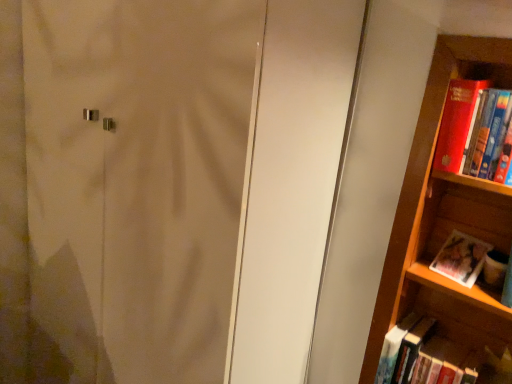
Question: Is matte white screen door at center looking in the opposite direction of hardcover book at lower right, positioned as the third book in top-to-bottom order?

Choices:
 (A) no
 (B) yes

Answer: (A)

Question: Is matte white screen door at center thinner than hardcover book at lower right, positioned as the first book in bottom-to-top order?

Choices:
 (A) yes
 (B) no

Answer: (B)

Question: Does matte white screen door at center turn towards hardcover book at lower right, positioned as the third book in top-to-bottom order?

Choices:
 (A) yes
 (B) no

Answer: (B)

Question: From the image's perspective, is matte white screen door at center below hardcover book at lower right, positioned as the third book in top-to-bottom order?

Choices:
 (A) no
 (B) yes

Answer: (A)

Question: Does matte white screen door at center lie in front of hardcover book at lower right, positioned as the third book in top-to-bottom order?

Choices:
 (A) yes
 (B) no

Answer: (A)

Question: Is matte paper photo album at right, which ranks as the 2th book in bottom-to-top order, in front of or behind hardcover book at lower right, positioned as the first book in bottom-to-top order, in the image?

Choices:
 (A) front
 (B) behind

Answer: (B)

Question: Is matte paper photo album at right, which ranks as the 2th book in bottom-to-top order, to the left or to the right of hardcover book at lower right, positioned as the third book in top-to-bottom order, in the image?

Choices:
 (A) right
 (B) left

Answer: (A)

Question: From a real-world perspective, relative to hardcover book at lower right, positioned as the first book in bottom-to-top order, is matte paper photo album at right, which ranks as the second book in top-to-bottom order, vertically above or below?

Choices:
 (A) below
 (B) above

Answer: (B)

Question: Is matte paper photo album at right, which ranks as the 2th book in bottom-to-top order, inside the boundaries of hardcover book at lower right, positioned as the first book in bottom-to-top order, or outside?

Choices:
 (A) outside
 (B) inside

Answer: (A)

Question: Considering their positions, is hardcover book at lower right, positioned as the first book in bottom-to-top order, located in front of or behind red matte book at right, which is counted as the 3th book, starting from the bottom?

Choices:
 (A) behind
 (B) front

Answer: (A)

Question: Considering the positions of point (440, 375) and point (489, 87), is point (440, 375) closer or farther from the camera than point (489, 87)?

Choices:
 (A) closer
 (B) farther

Answer: (B)

Question: Based on their positions, is hardcover book at lower right, positioned as the first book in bottom-to-top order, located to the left or right of red matte book at right, which is counted as the 3th book, starting from the bottom?

Choices:
 (A) left
 (B) right

Answer: (A)

Question: From a real-world perspective, is hardcover book at lower right, positioned as the first book in bottom-to-top order, positioned above or below red matte book at right, which is the 1th book from top to bottom?

Choices:
 (A) below
 (B) above

Answer: (A)

Question: Considering the relative positions of matte white screen door at center and red matte book at right, which is the 1th book from top to bottom, in the image provided, is matte white screen door at center to the left or to the right of red matte book at right, which is the 1th book from top to bottom,?

Choices:
 (A) right
 (B) left

Answer: (B)

Question: From a real-world perspective, is matte white screen door at center physically located above or below red matte book at right, which is counted as the 3th book, starting from the bottom?

Choices:
 (A) below
 (B) above

Answer: (A)